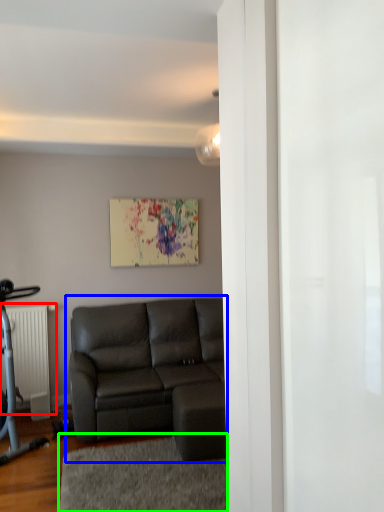
Question: Which object is positioned farthest from radiator (highlighted by a red box)? Select from studio couch (highlighted by a blue box) and yoga mat (highlighted by a green box).

Choices:
 (A) studio couch
 (B) yoga mat

Answer: (B)